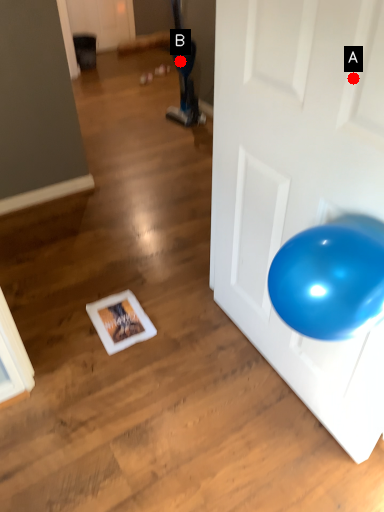
Question: Two points are circled on the image, labeled by A and B beside each circle. Which point is closer to the camera?

Choices:
 (A) A is closer
 (B) B is closer

Answer: (A)